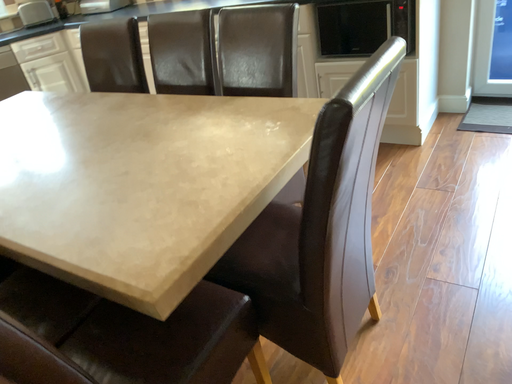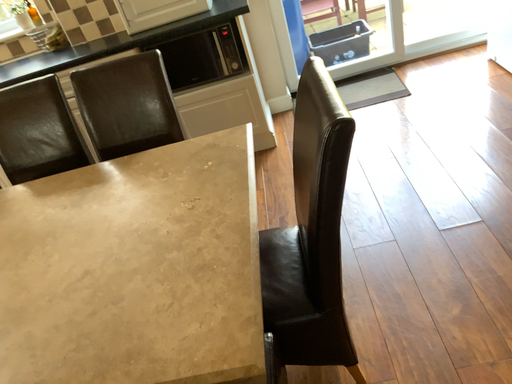
Question: Which way did the camera rotate in the video?

Choices:
 (A) rotated upward
 (B) rotated downward

Answer: (A)